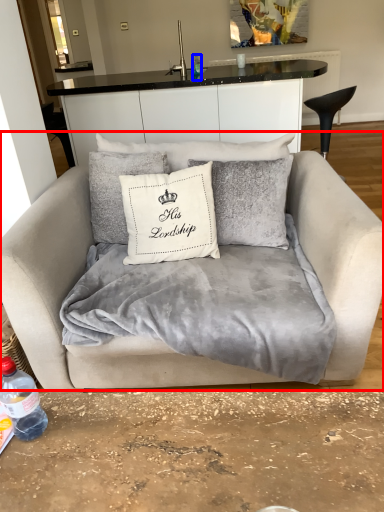
Question: Which point is closer to the camera, studio couch (highlighted by a red box) or bottle (highlighted by a blue box)?

Choices:
 (A) studio couch
 (B) bottle

Answer: (A)